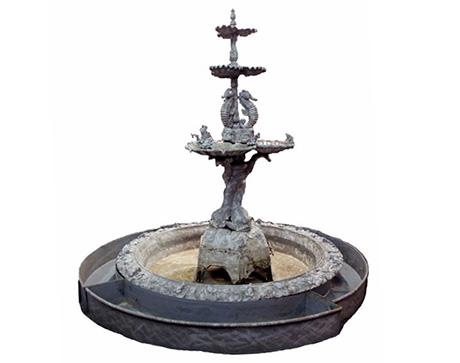
I want to click on light brown inner bowl, so click(282, 263).